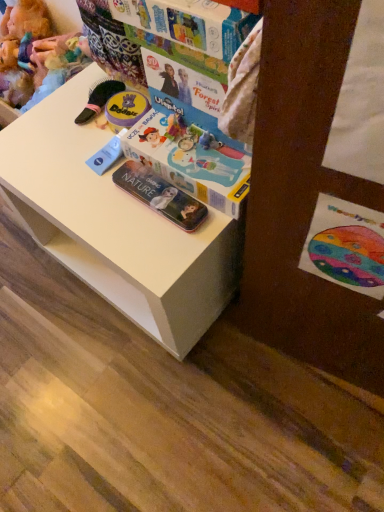
What do you see at coordinates (115, 225) in the screenshot? I see `white plastic changing table at center` at bounding box center [115, 225].

What do you see at coordinates (346, 246) in the screenshot?
I see `watercolor paper postcard at lower right` at bounding box center [346, 246].

This screenshot has height=512, width=384. I want to click on fuzzy fabric doll at upper left, so click(x=35, y=54).

Locate an element on the screen. multicolored cardboard book at upper center is located at coordinates (188, 23).

How many degrees apart are the facing directions of transparent plastic case at lower center and multicolored cardboard book at upper center?

The angular difference between transparent plastic case at lower center and multicolored cardboard book at upper center is 4.44 degrees.

From the image's perspective, is transparent plastic case at lower center located above multicolored cardboard book at upper center?

Incorrect, from the image's perspective, transparent plastic case at lower center is lower than multicolored cardboard book at upper center.

Is transparent plastic case at lower center positioned far away from multicolored cardboard book at upper center?

They are positioned close to each other.

In the image, is transparent plastic case at lower center positioned in front of or behind multicolored cardboard book at upper center?

transparent plastic case at lower center is behind multicolored cardboard book at upper center.

Looking at this image, from the image's perspective, which object appears higher, transparent plastic case at lower center or watercolor paper postcard at lower right?

transparent plastic case at lower center.

Visually, is transparent plastic case at lower center positioned to the left or to the right of watercolor paper postcard at lower right?

transparent plastic case at lower center is to the left of watercolor paper postcard at lower right.

Is transparent plastic case at lower center oriented towards watercolor paper postcard at lower right?

No, transparent plastic case at lower center does not turn towards watercolor paper postcard at lower right.

Is white plastic changing table at center positioned far away from multicolored cardboard book at upper center?

No, white plastic changing table at center is in close proximity to multicolored cardboard book at upper center.

Does point (66, 200) appear closer or farther from the camera than point (212, 14)?

Point (66, 200) is farther from the camera than point (212, 14).

In the image, is white plastic changing table at center on the left side or the right side of multicolored cardboard book at upper center?

In the image, white plastic changing table at center appears on the left side of multicolored cardboard book at upper center.

In the scene shown: Can you confirm if white plastic changing table at center is smaller than multicolored cardboard book at upper center?

No, white plastic changing table at center is not smaller than multicolored cardboard book at upper center.

From the image's perspective, does watercolor paper postcard at lower right appear lower than white plastic changing table at center?

Yes, from the image's perspective, watercolor paper postcard at lower right is beneath white plastic changing table at center.

Considering the relative positions of watercolor paper postcard at lower right and white plastic changing table at center in the image provided, is watercolor paper postcard at lower right to the left of white plastic changing table at center from the viewer's perspective?

No.

The height and width of the screenshot is (512, 384). Identify the location of postcard below the white plastic changing table at center (from the image's perspective). (346, 246).

Looking at this image, is watercolor paper postcard at lower right positioned with its back to white plastic changing table at center?

watercolor paper postcard at lower right does not have its back to white plastic changing table at center.

From a real-world perspective, which is physically above, white plastic changing table at center or transparent plastic case at lower center?

transparent plastic case at lower center is physically above.

From the image's perspective, is white plastic changing table at center positioned above or below transparent plastic case at lower center?

white plastic changing table at center is above transparent plastic case at lower center.

Is white plastic changing table at center turned away from transparent plastic case at lower center?

No.

Would you say white plastic changing table at center is a long distance from transparent plastic case at lower center?

Actually, white plastic changing table at center and transparent plastic case at lower center are a little close together.

Is watercolor paper postcard at lower right surrounded by multicolored cardboard book at upper center?

No, multicolored cardboard book at upper center does not contain watercolor paper postcard at lower right.

Considering the positions of points (216, 28) and (380, 229), is point (216, 28) closer to camera compared to point (380, 229)?

No, it is not.

Which of these two, multicolored cardboard book at upper center or watercolor paper postcard at lower right, stands shorter?

multicolored cardboard book at upper center is shorter.

From the image's perspective, which is above, white plastic changing table at center or fuzzy fabric doll at upper left?

From the image's view, fuzzy fabric doll at upper left is above.

Who is bigger, white plastic changing table at center or fuzzy fabric doll at upper left?

white plastic changing table at center is bigger.

Is white plastic changing table at center taller or shorter than fuzzy fabric doll at upper left?

white plastic changing table at center is taller than fuzzy fabric doll at upper left.

From a real-world perspective, is white plastic changing table at center located beneath fuzzy fabric doll at upper left?

Yes, from a real-world perspective, white plastic changing table at center is below fuzzy fabric doll at upper left.

Identify the location of paperback book that is behind the multicolored cardboard book at upper center. This screenshot has width=384, height=512. (160, 195).

You are a GUI agent. You are given a task and a screenshot of the screen. Output one action in this format:
    pyautogui.click(x=<x>, y=<y>)
    Task: Click on the paperback book above the watercolor paper postcard at lower right (from the image's perspective)
    
    Given the screenshot: What is the action you would take?
    pyautogui.click(x=160, y=195)

From the image, which object appears to be nearer to watercolor paper postcard at lower right, transparent plastic case at lower center or white plastic changing table at center?

transparent plastic case at lower center lies closer to watercolor paper postcard at lower right than the other object.

Based on their spatial positions, is watercolor paper postcard at lower right or multicolored cardboard book at upper center further from white plastic changing table at center?

The object further to white plastic changing table at center is multicolored cardboard book at upper center.

Looking at the image, which one is located further to multicolored cardboard book at upper center, transparent plastic case at lower center or fuzzy fabric doll at upper left?

Among the two, fuzzy fabric doll at upper left is located further to multicolored cardboard book at upper center.

When comparing their distances from white plastic changing table at center, does fuzzy fabric doll at upper left or multicolored cardboard book at upper center seem further?

Based on the image, fuzzy fabric doll at upper left appears to be further to white plastic changing table at center.

Looking at the image, which one is located closer to multicolored cardboard book at upper center, transparent plastic case at lower center or white plastic changing table at center?

The object closer to multicolored cardboard book at upper center is transparent plastic case at lower center.

Which object lies nearer to the anchor point watercolor paper postcard at lower right, transparent plastic case at lower center or multicolored cardboard book at upper center?

The object closer to watercolor paper postcard at lower right is transparent plastic case at lower center.

Based on their spatial positions, is multicolored cardboard book at upper center or fuzzy fabric doll at upper left further from white plastic changing table at center?

fuzzy fabric doll at upper left.

Based on their spatial positions, is fuzzy fabric doll at upper left or white plastic changing table at center further from watercolor paper postcard at lower right?

Based on the image, fuzzy fabric doll at upper left appears to be further to watercolor paper postcard at lower right.

Identify the location of paperback book that lies between multicolored cardboard book at upper center and watercolor paper postcard at lower right from top to bottom. (x=160, y=195).

Locate an element on the screen. This screenshot has width=384, height=512. changing table located between fuzzy fabric doll at upper left and multicolored cardboard book at upper center in the left-right direction is located at coordinates (115, 225).

Identify the location of changing table between fuzzy fabric doll at upper left and watercolor paper postcard at lower right from left to right. The image size is (384, 512). (115, 225).

Image resolution: width=384 pixels, height=512 pixels. I want to click on changing table between multicolored cardboard book at upper center and watercolor paper postcard at lower right vertically, so click(x=115, y=225).